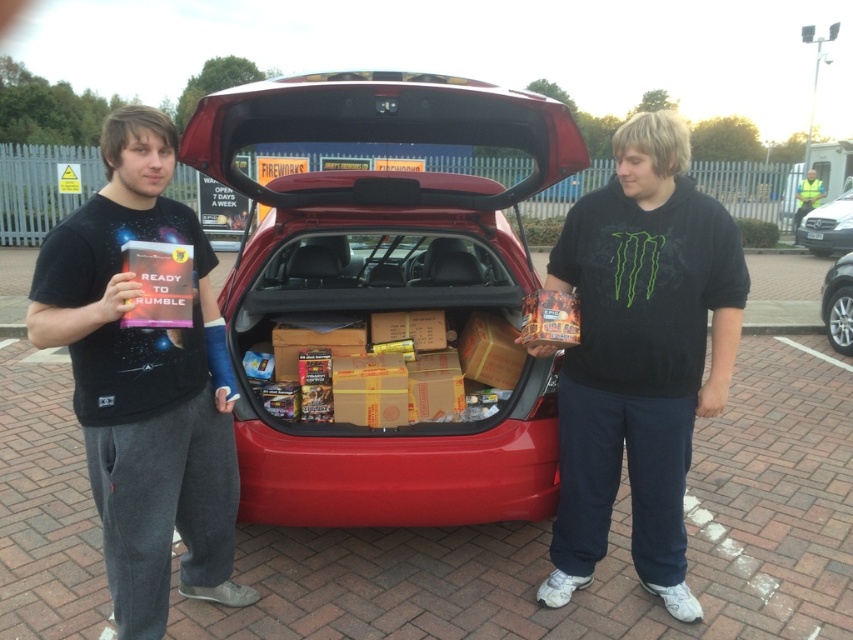
Question: Among these points, which one is nearest to the camera?

Choices:
 (A) (811, 252)
 (B) (793, 227)
 (C) (635, 364)
 (D) (68, 230)

Answer: (D)

Question: Can you confirm if black cotton t-shirt at left is bigger than shiny silver car at center?

Choices:
 (A) yes
 (B) no

Answer: (A)

Question: Does shiny silver car at center come behind yellow reflective vest at upper right?

Choices:
 (A) no
 (B) yes

Answer: (A)

Question: In this image, where is black cotton t-shirt at center located relative to black cotton t-shirt at left?

Choices:
 (A) above
 (B) below

Answer: (A)

Question: Which point is farther from the camera taking this photo?

Choices:
 (A) (825, 227)
 (B) (846, 260)
 (C) (520, 259)
 (D) (821, 196)

Answer: (D)

Question: Among these objects, which one is nearest to the camera?

Choices:
 (A) black cotton t-shirt at left
 (B) yellow reflective vest at upper right
 (C) black cotton t-shirt at center

Answer: (A)